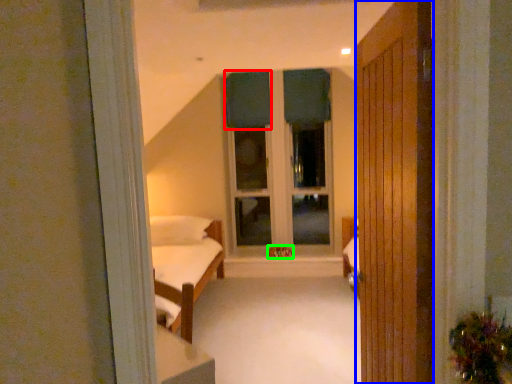
Question: Which object is the farthest from curtain (highlighted by a red box)? Choose among these: door (highlighted by a blue box) or toy (highlighted by a green box).

Choices:
 (A) door
 (B) toy

Answer: (A)